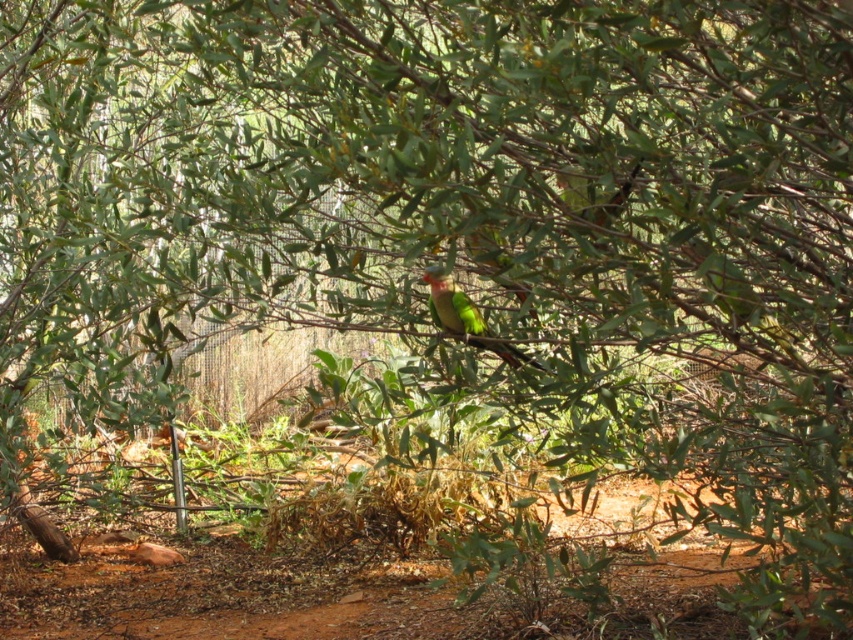
Question: Observing the image, what is the correct spatial positioning of dirt field at lower center in reference to green matte parrot at center?

Choices:
 (A) above
 (B) below

Answer: (B)

Question: Can you confirm if dirt field at lower center is smaller than green matte parrot at center?

Choices:
 (A) no
 (B) yes

Answer: (A)

Question: Among these points, which one is farthest from the camera?

Choices:
 (A) (679, 632)
 (B) (524, 356)

Answer: (A)

Question: Does dirt field at lower center have a smaller size compared to green matte parrot at center?

Choices:
 (A) yes
 (B) no

Answer: (B)